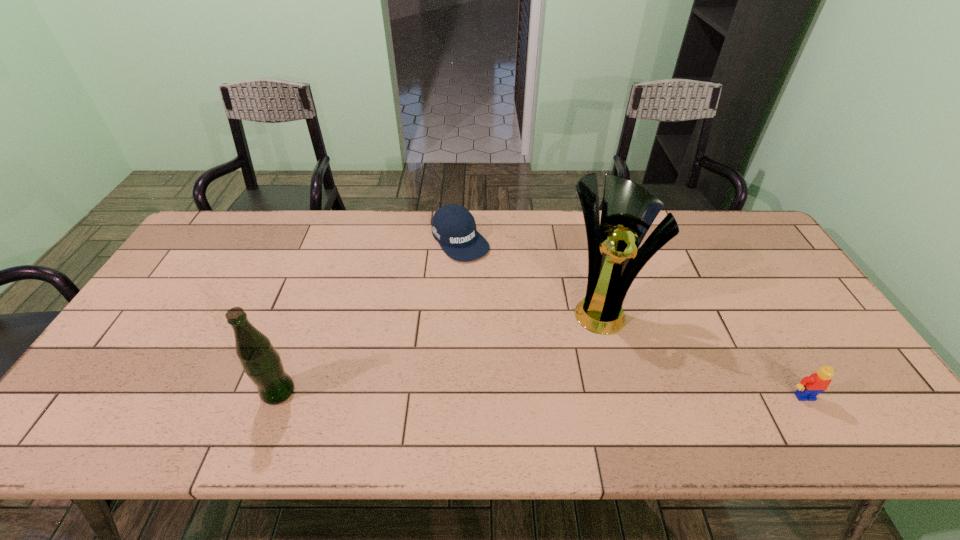
The width and height of the screenshot is (960, 540). In order to click on free spot between the farthest object and the rightmost object in this screenshot , I will do `click(633, 318)`.

Where is `empty space that is in between the shortest object and the second tallest object`? empty space that is in between the shortest object and the second tallest object is located at coordinates (370, 316).

This screenshot has width=960, height=540. Identify the location of vacant area between the beer bottle and the award. (439, 350).

The height and width of the screenshot is (540, 960). I want to click on vacant space that is in between the leftmost object and the award, so click(x=439, y=350).

Where is `blank region between the third shortest object and the Lego`? blank region between the third shortest object and the Lego is located at coordinates (541, 394).

Identify the location of unoccupied position between the third object from left to right and the beer bottle. (439, 350).

Image resolution: width=960 pixels, height=540 pixels. Identify the location of the second closest object to the Lego. (453, 226).

Identify which object is located as the nearest to the third shortest object. Please provide its 2D coordinates. Your answer should be formatted as a tuple, i.e. [(x, y)], where the tuple contains the x and y coordinates of a point satisfying the conditions above.

[(453, 226)]

Identify the location of vacant region that satisfies the following two spatial constraints: 1. on the back side of the shortest object; 2. on the right side of the leftmost object. This screenshot has width=960, height=540. (335, 240).

Where is `free space that satisfies the following two spatial constraints: 1. on the back side of the beer bottle; 2. on the right side of the third object from left to right`? free space that satisfies the following two spatial constraints: 1. on the back side of the beer bottle; 2. on the right side of the third object from left to right is located at coordinates (310, 308).